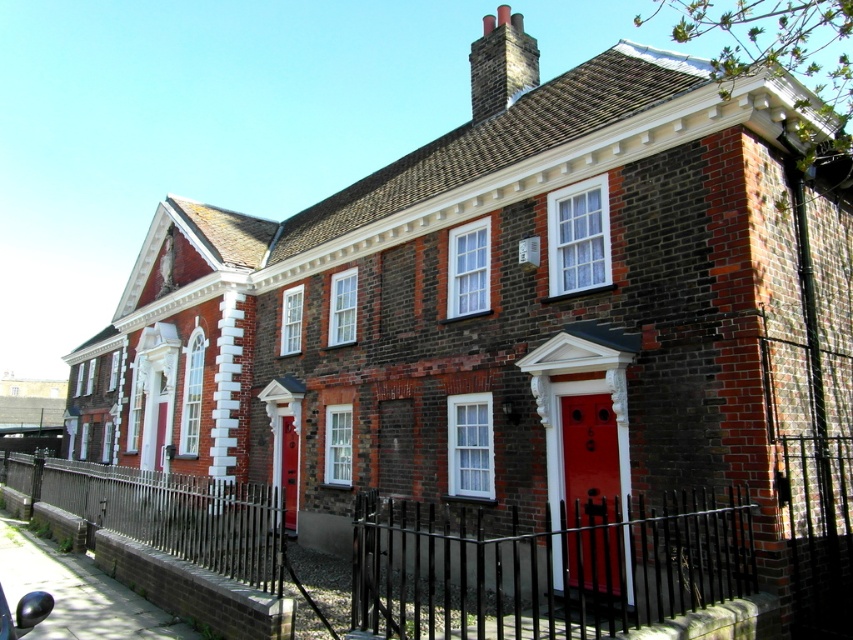
You are standing in front of the traditional brick building and want to walk towards the smooth glossy red door at center. Which direction should you move relative to the black metal fence at lower center?

You should move to the right of the black metal fence at lower center to reach the smooth glossy red door at center since the black metal fence at lower center is to the left of the door.

You are standing in front of a traditional brick building with two red doors. One is the smooth glossy red door at center and the other is another red door on the left side. Based on their positions, which red door is closer to the right side of the building?

The smooth glossy red door at center is closer to the right side of the building because its position at point [590,492] places it on the right side compared to the other red door on the left side.

You are a delivery person trying to pass through the black metal fence at lower center and the matte red door at center. Which one has a wider opening? Please check the width of both to decide.

The black metal fence at lower center has a larger width than the matte red door at center, so the opening of the black metal fence at lower center is wider than the matte red door at center.